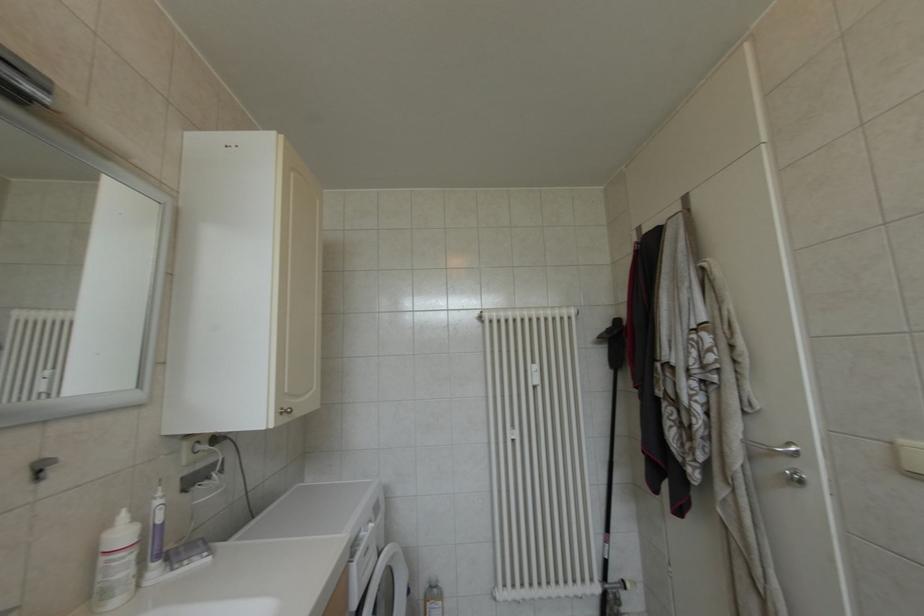
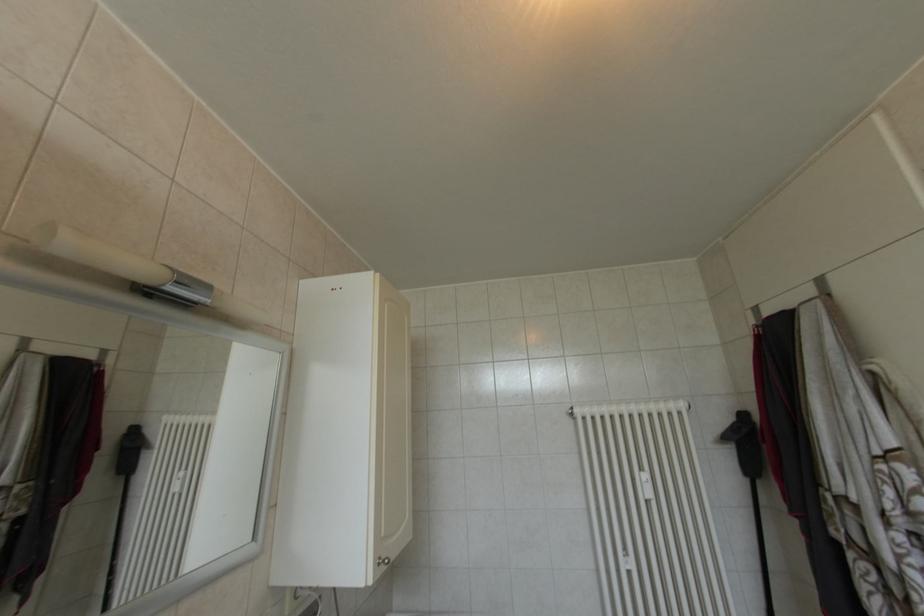
Question: How did the camera likely rotate?

Choices:
 (A) Left
 (B) Right
 (C) Up
 (D) Down

Answer: (A)